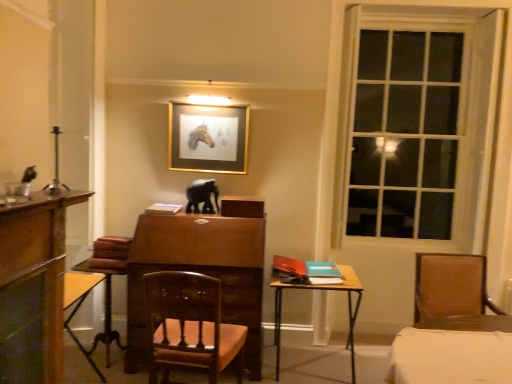
Image resolution: width=512 pixels, height=384 pixels. I want to click on clear glass window at right, so click(x=416, y=127).

In order to face gold metallic picture frame at upper center, should I rotate leftwards or rightwards?

To face it directly, rotate left by 6.500 degrees.

Where is `wooden table at center, which ranks as the 2th table in left-to-right order`? The width and height of the screenshot is (512, 384). wooden table at center, which ranks as the 2th table in left-to-right order is located at coordinates (319, 289).

Considering the relative sizes of white matte book at center and black glossy elephant at center in the image provided, is white matte book at center wider than black glossy elephant at center?

Yes.

From the image's perspective, is white matte book at center below black glossy elephant at center?

Yes, from the image's perspective, white matte book at center is below black glossy elephant at center.

How much distance is there between white matte book at center and black glossy elephant at center?

white matte book at center is 8.97 inches away from black glossy elephant at center.

Is white matte book at center oriented towards black glossy elephant at center?

No, white matte book at center is not oriented towards black glossy elephant at center.

From the image's perspective, is white matte book at center above or below clear glass window at right?

From the image's perspective, white matte book at center appears below clear glass window at right.

Is white matte book at center facing towards clear glass window at right?

No, white matte book at center does not turn towards clear glass window at right.

Can you confirm if white matte book at center is shorter than clear glass window at right?

Indeed, white matte book at center has a lesser height compared to clear glass window at right.

Looking at this image, does white matte book at center have a smaller size compared to clear glass window at right?

Indeed, white matte book at center has a smaller size compared to clear glass window at right.

Can you see brown leather chair at right, marked as the 1th chair in a right-to-left arrangement, touching black glossy elephant at center?

No, brown leather chair at right, marked as the 1th chair in a right-to-left arrangement, is not making contact with black glossy elephant at center.

I want to click on animal that appears above the brown leather chair at right, marked as the 1th chair in a right-to-left arrangement (from the image's perspective), so pyautogui.click(x=202, y=195).

From the image's perspective, is brown leather chair at right, marked as the 1th chair in a right-to-left arrangement, located beneath black glossy elephant at center?

Correct, brown leather chair at right, marked as the 1th chair in a right-to-left arrangement, appears lower than black glossy elephant at center in the image.

Considering the relative positions of brown leather chair at right, marked as the 1th chair in a right-to-left arrangement, and black glossy elephant at center in the image provided, is brown leather chair at right, marked as the 1th chair in a right-to-left arrangement, to the left of black glossy elephant at center from the viewer's perspective?

No.

This screenshot has height=384, width=512. What are the coordinates of `picture frame located above the wooden polished chair at center, the 2th chair from the right (from a real-world perspective)` in the screenshot? It's located at (208, 138).

From a real-world perspective, which is physically above, gold metallic picture frame at upper center or wooden polished chair at center, the first chair positioned from the left?

gold metallic picture frame at upper center.

Can you confirm if gold metallic picture frame at upper center is positioned to the left of wooden polished chair at center, the first chair positioned from the left?

Indeed, gold metallic picture frame at upper center is positioned on the left side of wooden polished chair at center, the first chair positioned from the left.

Is gold metallic picture frame at upper center taller than wooden polished chair at center, the first chair positioned from the left?

In fact, gold metallic picture frame at upper center may be shorter than wooden polished chair at center, the first chair positioned from the left.

From the picture: Considering the positions of objects clear glass window at right and white matte book at center in the image provided, who is more to the right, clear glass window at right or white matte book at center?

clear glass window at right is more to the right.

Is white matte book at center completely or partially inside clear glass window at right?

No, clear glass window at right does not contain white matte book at center.

From the image's perspective, is clear glass window at right under white matte book at center?

Actually, clear glass window at right appears above white matte book at center in the image.

Can you confirm if clear glass window at right is wider than white matte book at center?

No.

Can you confirm if wooden table at center, which ranks as the 2th table in left-to-right order, is positioned to the right of brown leather chair at right, placed as the second chair when sorted from left to right?

No.

How distant is wooden table at center, which ranks as the 2th table in left-to-right order, from brown leather chair at right, marked as the 1th chair in a right-to-left arrangement?

wooden table at center, which ranks as the 2th table in left-to-right order, is 29.83 inches away from brown leather chair at right, marked as the 1th chair in a right-to-left arrangement.

Consider the image. Who is smaller, wooden table at center, which is the first table in right-to-left order, or brown leather chair at right, marked as the 1th chair in a right-to-left arrangement?

Smaller between the two is brown leather chair at right, marked as the 1th chair in a right-to-left arrangement.

Between wooden table at center, which is the first table in right-to-left order, and brown leather chair at right, marked as the 1th chair in a right-to-left arrangement, which one has less height?

Standing shorter between the two is brown leather chair at right, marked as the 1th chair in a right-to-left arrangement.

Which object is positioned more to the right, clear glass window at right or black glossy elephant at center?

From the viewer's perspective, clear glass window at right appears more on the right side.

Can you confirm if clear glass window at right is wider than black glossy elephant at center?

Incorrect, the width of clear glass window at right does not surpass that of black glossy elephant at center.

Is point (492, 27) less distant than point (188, 191)?

Yes, point (492, 27) is in front of point (188, 191).

Choose the correct answer: Is clear glass window at right inside black glossy elephant at center or outside it?

clear glass window at right is spatially situated outside black glossy elephant at center.

Where is `book located in front of the black glossy elephant at center`? The width and height of the screenshot is (512, 384). book located in front of the black glossy elephant at center is located at coordinates (163, 209).

At what (x,y) coordinates should I click in order to perform the action: click on book below the clear glass window at right (from the image's perspective). Please return your answer as a coordinate pair (x, y). Looking at the image, I should click on (163, 209).

In the scene shown: Based on their spatial positions, is black glossy elephant at center or wooden table at lower left, the second table when ordered from right to left, further from wooden table at center, which is the first table in right-to-left order?

wooden table at lower left, the second table when ordered from right to left, is further to wooden table at center, which is the first table in right-to-left order.

From the image, which object appears to be nearer to wooden table at lower left, the second table when ordered from right to left, wooden polished chair at center, the first chair positioned from the left, or clear glass window at right?

Based on the image, wooden polished chair at center, the first chair positioned from the left, appears to be nearer to wooden table at lower left, the second table when ordered from right to left.

Estimate the real-world distances between objects in this image. Which object is closer to white matte book at center, black glossy elephant at center or wooden table at lower left, the 1th table in the left-to-right sequence?

black glossy elephant at center.

Estimate the real-world distances between objects in this image. Which object is further from gold metallic picture frame at upper center, brown leather chair at right, marked as the 1th chair in a right-to-left arrangement, or wooden table at center, which is the first table in right-to-left order?

brown leather chair at right, marked as the 1th chair in a right-to-left arrangement, is positioned further to the anchor gold metallic picture frame at upper center.

Which object lies nearer to the anchor point brown leather chair at right, placed as the second chair when sorted from left to right, wooden polished chair at center, the 2th chair from the right, or wooden table at lower left, the second table when ordered from right to left?

Based on the image, wooden polished chair at center, the 2th chair from the right, appears to be nearer to brown leather chair at right, placed as the second chair when sorted from left to right.

Estimate the real-world distances between objects in this image. Which object is further from wooden polished chair at center, the first chair positioned from the left, wooden table at lower left, the 1th table in the left-to-right sequence, or clear glass window at right?

Based on the image, clear glass window at right appears to be further to wooden polished chair at center, the first chair positioned from the left.

Considering their positions, is wooden table at lower left, the 1th table in the left-to-right sequence, positioned further to clear glass window at right than wooden table at center, which is the first table in right-to-left order?

wooden table at lower left, the 1th table in the left-to-right sequence, lies further to clear glass window at right than the other object.

Estimate the real-world distances between objects in this image. Which object is further from white matte book at center, clear glass window at right or gold metallic picture frame at upper center?

Among the two, clear glass window at right is located further to white matte book at center.

Locate an element on the screen. chair located between gold metallic picture frame at upper center and brown leather chair at right, marked as the 1th chair in a right-to-left arrangement, in the left-right direction is located at coordinates (189, 326).

This screenshot has width=512, height=384. Identify the location of table located between white matte book at center and brown leather chair at right, placed as the second chair when sorted from left to right, in the left-right direction. (319, 289).

At what (x,y) coordinates should I click in order to perform the action: click on chair situated between white matte book at center and clear glass window at right from left to right. Please return your answer as a coordinate pair (x, y). Looking at the image, I should click on (189, 326).

At what (x,y) coordinates should I click in order to perform the action: click on animal between gold metallic picture frame at upper center and wooden polished chair at center, the 2th chair from the right, in the up-down direction. Please return your answer as a coordinate pair (x, y). Looking at the image, I should click on (202, 195).